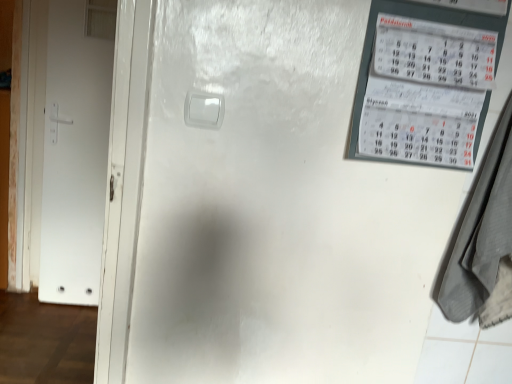
Find the location of a particular element. gray fabric laundry at right is located at coordinates (484, 239).

Image resolution: width=512 pixels, height=384 pixels. Describe the element at coordinates (484, 239) in the screenshot. I see `gray fabric laundry at right` at that location.

The height and width of the screenshot is (384, 512). Describe the element at coordinates (75, 149) in the screenshot. I see `white matte door at left` at that location.

Where is `white matte door at left`? The height and width of the screenshot is (384, 512). white matte door at left is located at coordinates (75, 149).

You are a GUI agent. You are given a task and a screenshot of the screen. Output one action in this format:
    pyautogui.click(x=<x>, y=<y>)
    Task: Click on the gray fabric laundry at right
    This screenshot has height=384, width=512.
    Given the screenshot: What is the action you would take?
    pyautogui.click(x=484, y=239)

Between white matte door at left and gray fabric laundry at right, which one appears on the right side from the viewer's perspective?

gray fabric laundry at right is more to the right.

Between white matte door at left and gray fabric laundry at right, which one is positioned behind?

white matte door at left is further away from the camera.

Which is nearer, (68, 26) or (476, 217)?

The point (476, 217) is in front.

From the image's perspective, which object appears higher, white matte door at left or gray fabric laundry at right?

white matte door at left appears higher in the image.

From a real-world perspective, between white matte door at left and gray fabric laundry at right, who is vertically lower?

white matte door at left.

Is white matte door at left wider or thinner than gray fabric laundry at right?

Considering their sizes, white matte door at left looks slimmer than gray fabric laundry at right.

Consider the image. From their relative heights in the image, would you say white matte door at left is taller or shorter than gray fabric laundry at right?

In the image, white matte door at left appears to be taller than gray fabric laundry at right.

Is white matte door at left smaller than gray fabric laundry at right?

Indeed, white matte door at left has a smaller size compared to gray fabric laundry at right.

Is white matte door at left outside of gray fabric laundry at right?

Yes, white matte door at left is located beyond the bounds of gray fabric laundry at right.

Is white matte door at left not close to gray fabric laundry at right?

Yes, white matte door at left is far from gray fabric laundry at right.

Is white matte door at left facing away from gray fabric laundry at right?

No, white matte door at left's orientation is not away from gray fabric laundry at right.

What's the angular difference between white matte door at left and gray fabric laundry at right's facing directions?

white matte door at left and gray fabric laundry at right are facing 0.121 degrees away from each other.

The width and height of the screenshot is (512, 384). Identify the location of laundry located on the right of white matte door at left. click(x=484, y=239).

Would you say gray fabric laundry at right is to the left or to the right of white matte door at left in the picture?

gray fabric laundry at right is positioned on white matte door at left's right side.

Is gray fabric laundry at right in front of or behind white matte door at left in the image?

Clearly, gray fabric laundry at right is in front of white matte door at left.

Which is closer, (469, 275) or (100, 3)?

Clearly, point (469, 275) is closer to the camera than point (100, 3).

From the image's perspective, is gray fabric laundry at right under white matte door at left?

Yes, from the image's perspective, gray fabric laundry at right is beneath white matte door at left.

From a real-world perspective, which is physically below, gray fabric laundry at right or white matte door at left?

white matte door at left.

Is gray fabric laundry at right thinner than white matte door at left?

In fact, gray fabric laundry at right might be wider than white matte door at left.

Can you confirm if gray fabric laundry at right is taller than white matte door at left?

No.

Can you confirm if gray fabric laundry at right is smaller than white matte door at left?

Incorrect, gray fabric laundry at right is not smaller in size than white matte door at left.

Is gray fabric laundry at right outside of white matte door at left?

Yes, gray fabric laundry at right is not within white matte door at left.

Is gray fabric laundry at right not near white matte door at left?

gray fabric laundry at right is far away from white matte door at left.

Is gray fabric laundry at right facing towards white matte door at left?

No, gray fabric laundry at right is not turned towards white matte door at left.

What's the angular difference between gray fabric laundry at right and white matte door at left's facing directions?

The angular difference between gray fabric laundry at right and white matte door at left is 0.121 degrees.

How far apart are gray fabric laundry at right and white matte door at left?

A distance of 6.52 feet exists between gray fabric laundry at right and white matte door at left.

At what (x,y) coordinates should I click in order to perform the action: click on laundry in front of the white matte door at left. Please return your answer as a coordinate pair (x, y). The width and height of the screenshot is (512, 384). Looking at the image, I should click on (484, 239).

The width and height of the screenshot is (512, 384). I want to click on door above the gray fabric laundry at right (from the image's perspective), so click(75, 149).

This screenshot has height=384, width=512. In order to click on door lying on the left of gray fabric laundry at right in this screenshot , I will do `click(75, 149)`.